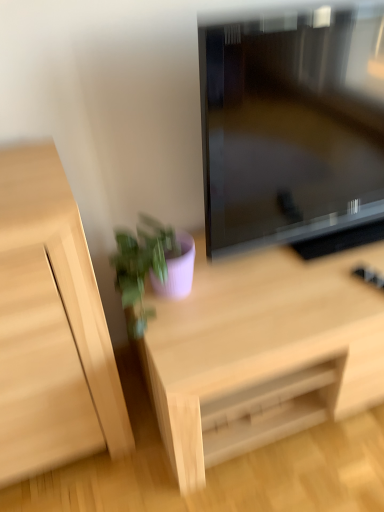
Question: Looking at the image, does light wood desk at center seem bigger or smaller compared to light wood cabinet at left?

Choices:
 (A) small
 (B) big

Answer: (B)

Question: Is light wood desk at center in front of or behind light wood cabinet at left in the image?

Choices:
 (A) behind
 (B) front

Answer: (A)

Question: Which of these objects is positioned closest to the light wood desk at center?

Choices:
 (A) light wood cabinet at left
 (B) matte purple pot at lower center
 (C) matte black television at center

Answer: (B)

Question: Considering the real-world distances, which object is farthest from the light wood cabinet at left?

Choices:
 (A) matte purple pot at lower center
 (B) light wood desk at center
 (C) matte black television at center

Answer: (C)